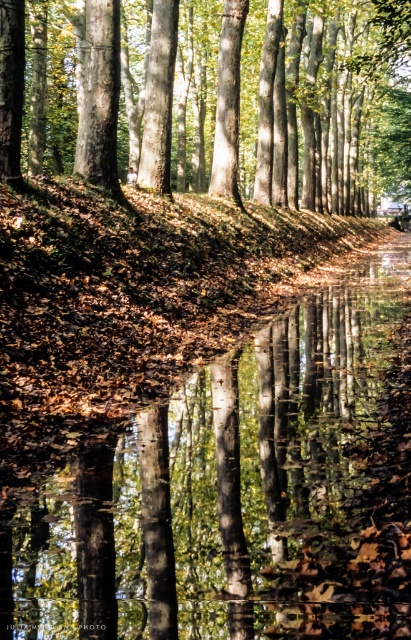
Can you confirm if brown reflective water at center is taller than smooth bark tree at center?

Incorrect, brown reflective water at center's height is not larger of smooth bark tree at center's.

Is brown reflective water at center smaller than smooth bark tree at center?

Correct, brown reflective water at center occupies less space than smooth bark tree at center.

Measure the distance between point (366, 493) and camera.

Point (366, 493) is 17.27 feet away from camera.

Locate an element on the screen. The image size is (411, 640). brown reflective water at center is located at coordinates (237, 492).